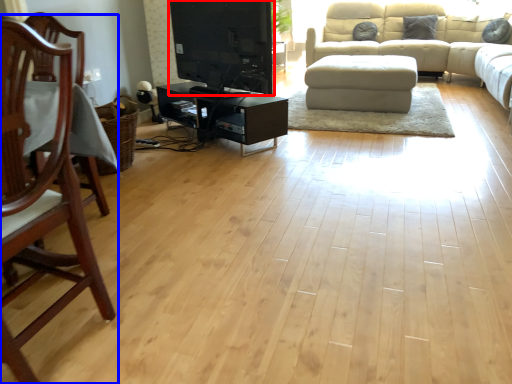
Question: Which object is further to the camera taking this photo, entertainment center (highlighted by a red box) or chair (highlighted by a blue box)?

Choices:
 (A) entertainment center
 (B) chair

Answer: (A)